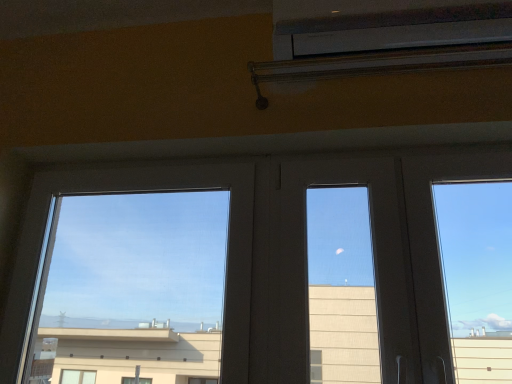
Question: In the image, is white plastic air conditioning unit at upper center positioned in front of or behind transparent glass window at left?

Choices:
 (A) front
 (B) behind

Answer: (A)

Question: Is white plastic air conditioning unit at upper center bigger or smaller than transparent glass window at left?

Choices:
 (A) small
 (B) big

Answer: (A)

Question: Which is correct: white plastic air conditioning unit at upper center is inside transparent glass window at left, or outside of it?

Choices:
 (A) outside
 (B) inside

Answer: (A)

Question: From the image's perspective, relative to white plastic air conditioning unit at upper center, is transparent glass window at left above or below?

Choices:
 (A) above
 (B) below

Answer: (B)

Question: Is transparent glass window at left spatially inside white plastic air conditioning unit at upper center, or outside of it?

Choices:
 (A) outside
 (B) inside

Answer: (A)

Question: Is transparent glass window at left in front of or behind white plastic air conditioning unit at upper center in the image?

Choices:
 (A) behind
 (B) front

Answer: (A)

Question: Considering the positions of transparent glass window at left and white plastic air conditioning unit at upper center in the image, is transparent glass window at left taller or shorter than white plastic air conditioning unit at upper center?

Choices:
 (A) short
 (B) tall

Answer: (B)